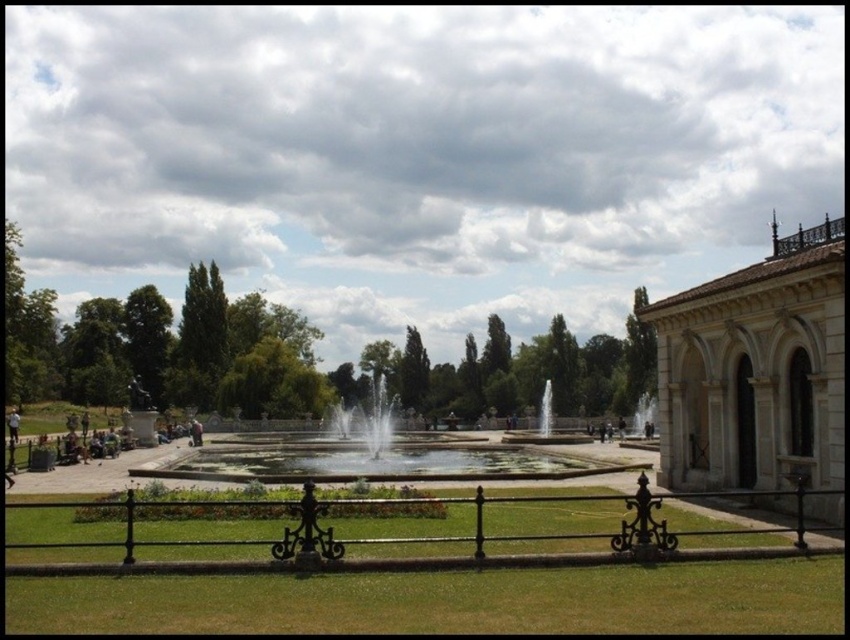
Question: Which of these objects is positioned farthest from the black wrought iron fence at center?

Choices:
 (A) white stone building at right
 (B) clear water fountain at center

Answer: (B)

Question: Can you confirm if white stone building at right is positioned above black wrought iron fence at center?

Choices:
 (A) no
 (B) yes

Answer: (B)

Question: In this image, where is white stone building at right located relative to black wrought iron fence at center?

Choices:
 (A) below
 (B) above

Answer: (B)

Question: Which object is farther from the camera taking this photo?

Choices:
 (A) white stone building at right
 (B) black wrought iron fence at center

Answer: (A)

Question: Does black wrought iron fence at center appear on the right side of clear water fountain at center?

Choices:
 (A) no
 (B) yes

Answer: (B)

Question: Which point is farther from the camera taking this photo?

Choices:
 (A) (408, 470)
 (B) (724, 429)

Answer: (A)